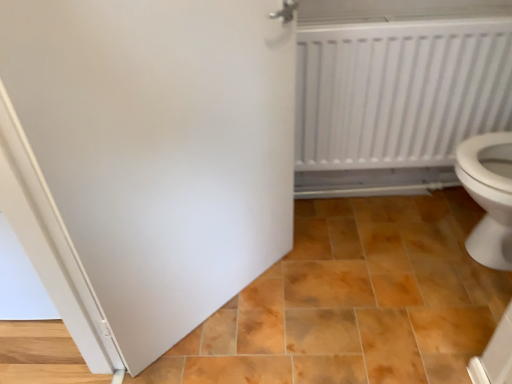
Question: From the image's perspective, is white plastic radiator at upper right above white matte door at center?

Choices:
 (A) no
 (B) yes

Answer: (B)

Question: Does white plastic radiator at upper right lie behind white matte door at center?

Choices:
 (A) no
 (B) yes

Answer: (B)

Question: Is white plastic radiator at upper right at the right side of white matte door at center?

Choices:
 (A) no
 (B) yes

Answer: (B)

Question: From the image's perspective, is white plastic radiator at upper right beneath white matte door at center?

Choices:
 (A) no
 (B) yes

Answer: (A)

Question: Does white plastic radiator at upper right have a greater height compared to white matte door at center?

Choices:
 (A) yes
 (B) no

Answer: (B)

Question: Considering the relative sizes of white plastic radiator at upper right and white matte door at center in the image provided, is white plastic radiator at upper right bigger than white matte door at center?

Choices:
 (A) yes
 (B) no

Answer: (B)

Question: From the image's perspective, is white matte door at center above brown glossy tile at center?

Choices:
 (A) yes
 (B) no

Answer: (A)

Question: Does white matte door at center turn towards brown glossy tile at center?

Choices:
 (A) no
 (B) yes

Answer: (B)

Question: Can you confirm if white matte door at center is taller than brown glossy tile at center?

Choices:
 (A) yes
 (B) no

Answer: (A)

Question: Is white matte door at center smaller than brown glossy tile at center?

Choices:
 (A) no
 (B) yes

Answer: (B)

Question: Is white matte door at center outside of brown glossy tile at center?

Choices:
 (A) yes
 (B) no

Answer: (A)

Question: Considering the relative sizes of white matte door at center and brown glossy tile at center in the image provided, is white matte door at center shorter than brown glossy tile at center?

Choices:
 (A) yes
 (B) no

Answer: (B)

Question: Is white matte door at center surrounding white plastic radiator at upper right?

Choices:
 (A) no
 (B) yes

Answer: (A)